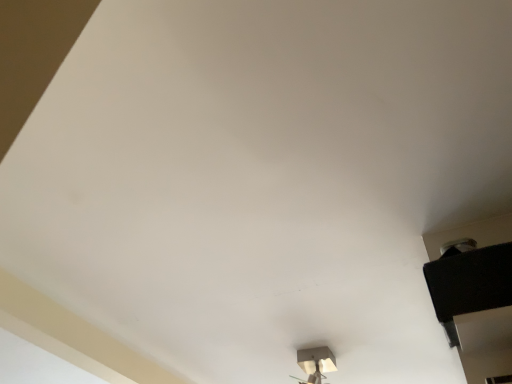
Locate an element on the screen. The image size is (512, 384). black matte speaker at upper right is located at coordinates (469, 282).

What do you see at coordinates (469, 282) in the screenshot? Image resolution: width=512 pixels, height=384 pixels. I see `black matte speaker at upper right` at bounding box center [469, 282].

Identify the location of black matte speaker at upper right. This screenshot has height=384, width=512. (469, 282).